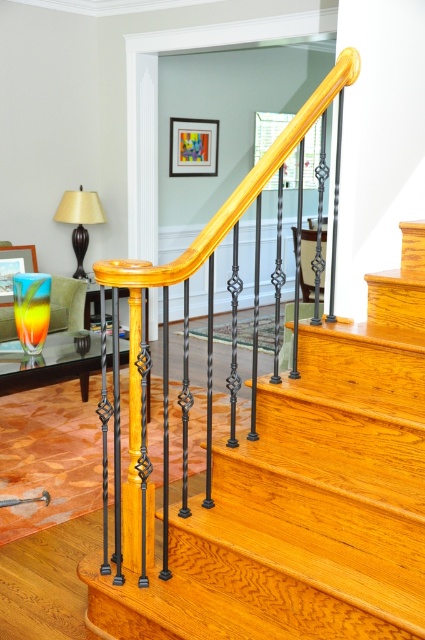
Is matte wood stairs at center positioned behind matte black lampshade at left?

No.

Can you confirm if matte wood stairs at center is smaller than matte black lampshade at left?

No, matte wood stairs at center is not smaller than matte black lampshade at left.

Describe the element at coordinates (308, 497) in the screenshot. Image resolution: width=425 pixels, height=640 pixels. I see `matte wood stairs at center` at that location.

Locate an element on the screen. This screenshot has height=640, width=425. matte wood stairs at center is located at coordinates (308, 497).